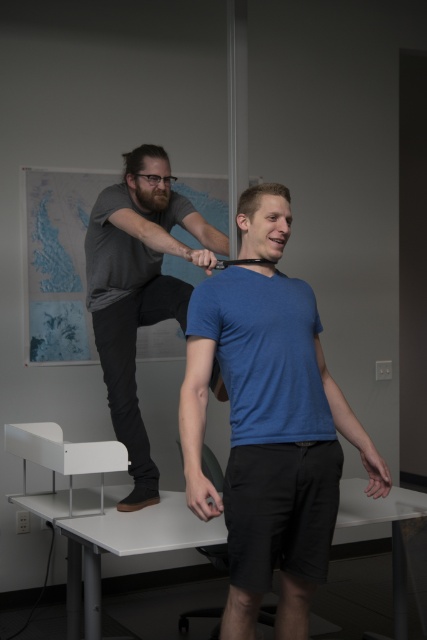
Which is more to the right, blue matte shirt at center or gray matte t-shirt at upper center?

From the viewer's perspective, blue matte shirt at center appears more on the right side.

Which is behind, point (234, 541) or point (99, 276)?

The point (99, 276) is behind.

This screenshot has height=640, width=427. I want to click on blue matte shirt at center, so click(x=269, y=442).